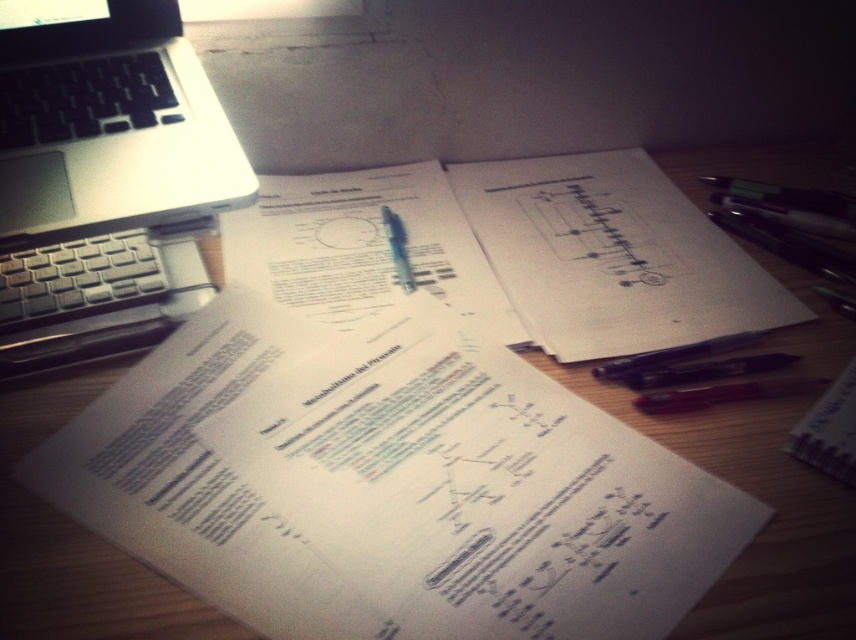
You are organizing items on a desk and need to place a new item exactly at the point marked by the coordinates point (x=104, y=179). What object is currently located at that position?

The point (x=104, y=179) indicates the silver metallic laptop at upper left is currently located there.

You are organizing your desk and need to place both the white paper at center and the red matte pen at lower right into a drawer. The drawer has a maximum height capacity of 10 cm. Can you fit both items vertically without bending or folding them?

The white paper at center is bigger than the red matte pen at lower right. However, the question does not provide specific height measurements for either item. Therefore, it is impossible to determine if they can fit vertically in the drawer based on the given information.

You are organizing your desk and need to place a 15 inch laptop stand between the silver metallic laptop at upper left and the white paper at center. Is there enough space?

The silver metallic laptop at upper left is 14.79 inches from the white paper at center, so there is not enough space to place a 15 inch laptop stand between them.